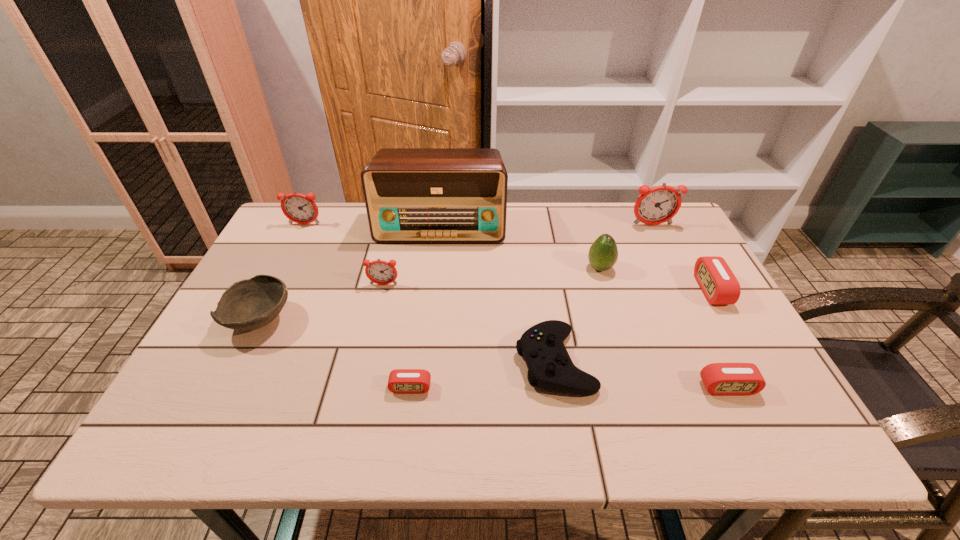
Select which alarm clock appears as the fourth closest to the second shortest alarm clock. Please provide its 2D coordinates. Your answer should be formatted as a tuple, i.e. [(x, y)], where the tuple contains the x and y coordinates of a point satisfying the conditions above.

[(381, 272)]

Choose which reddish-pink alarm clock is the second nearest neighbor to the biggest reddish-pink alarm clock. Please provide its 2D coordinates. Your answer should be formatted as a tuple, i.e. [(x, y)], where the tuple contains the x and y coordinates of a point satisfying the conditions above.

[(298, 208)]

Locate an element on the screen. Image resolution: width=960 pixels, height=540 pixels. reddish-pink alarm clock that is the closest one to the biggest reddish-pink alarm clock is located at coordinates (381, 272).

Where is `the second closest pink alarm clock relative to the fifth tallest alarm clock`? This screenshot has height=540, width=960. the second closest pink alarm clock relative to the fifth tallest alarm clock is located at coordinates (401, 381).

Identify which pink alarm clock is located as the second nearest to the rightmost reddish-pink alarm clock. Please provide its 2D coordinates. Your answer should be formatted as a tuple, i.e. [(x, y)], where the tuple contains the x and y coordinates of a point satisfying the conditions above.

[(725, 379)]

Locate an element on the screen. vacant region that satisfies the following two spatial constraints: 1. on the front-facing side of the avocado; 2. on the right side of the tallest object is located at coordinates (436, 268).

Identify the location of vacant area that satisfies the following two spatial constraints: 1. on the front-facing side of the control; 2. on the right side of the second smallest reddish-pink alarm clock. This screenshot has height=540, width=960. (235, 361).